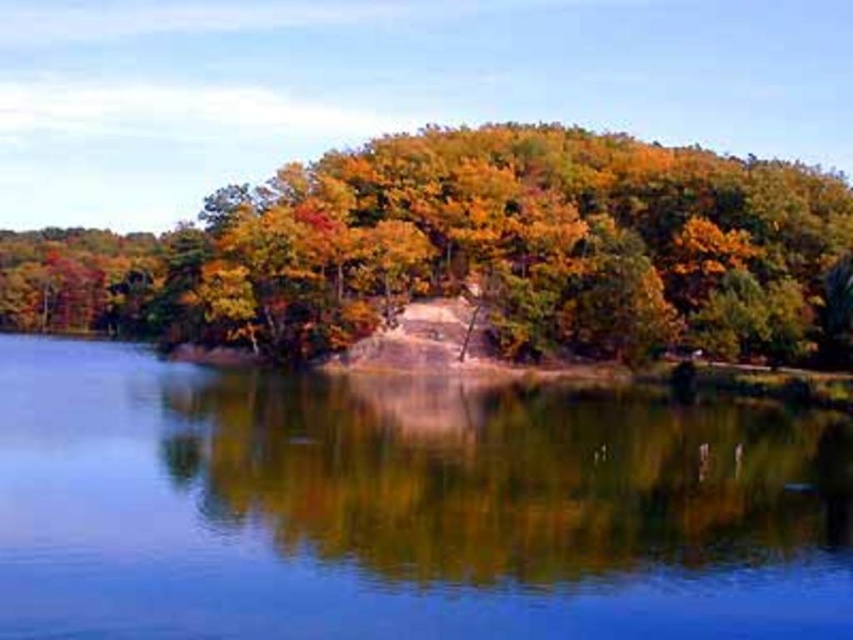
You are standing at the edge of the clear water at center and want to place a small statue on the shiny golden leaves at center. Considering their positions, will the statue be visible above the water level when placed there?

The shiny golden leaves at center are higher than the clear water at center. Therefore, placing the statue on the shiny golden leaves at center will make it visible above the water level.

You are standing on the dirt path and see the clear water at center and the shiny golden leaves at center. Which object is located lower in the scene?

The clear water at center is located lower than the shiny golden leaves at center.

You are standing at the point marked by the coordinates point (403, 508) in the image. Based on the scene description, what would you most likely see around you?

The point (403, 508) corresponds to clear water at center, so you would most likely see the vibrant autumn foliage reflected in the clear water around you.